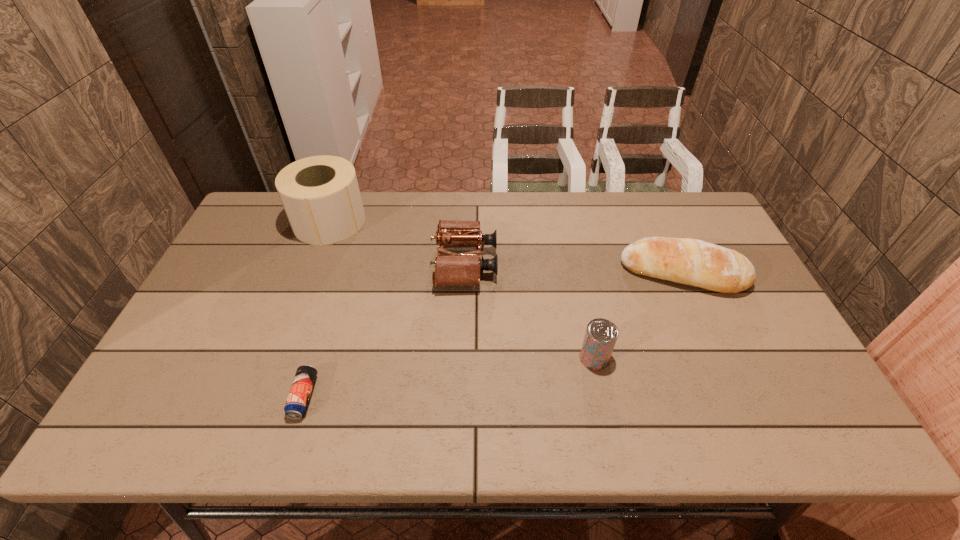
You are a GUI agent. You are given a task and a screenshot of the screen. Output one action in this format:
    pyautogui.click(x=<x>, y=<y>)
    Task: Click on the vacant space that satisfies the following two spatial constraints: 1. on the back side of the shorter beer can; 2. on the left side of the bread
    
    Given the screenshot: What is the action you would take?
    pyautogui.click(x=342, y=273)